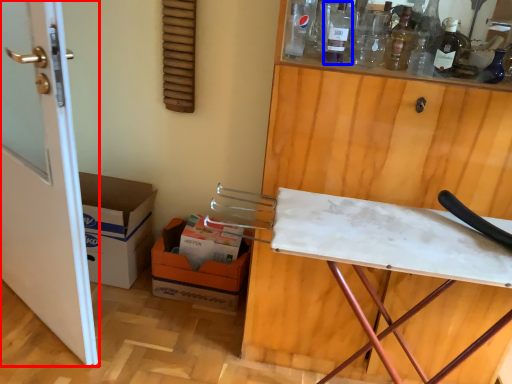
Question: Which object appears farthest to the camera in this image, door (highlighted by a red box) or bottle (highlighted by a blue box)?

Choices:
 (A) door
 (B) bottle

Answer: (B)